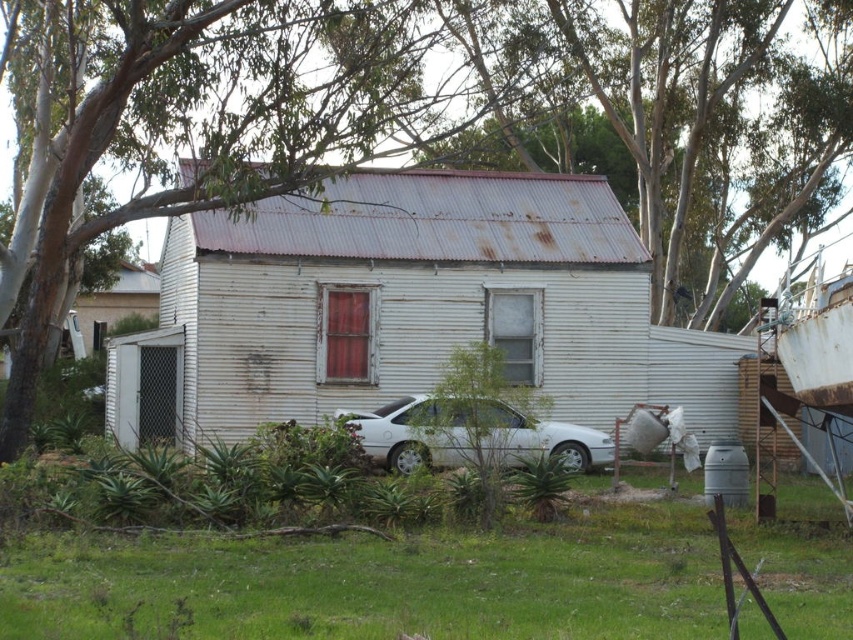
Question: Which point is closer to the camera?

Choices:
 (A) green leafy tree at upper center
 (B) rusty metal roof at upper center

Answer: (A)

Question: Does green grass at lower center come behind white matte car at center?

Choices:
 (A) yes
 (B) no

Answer: (B)

Question: Observing the image, what is the correct spatial positioning of green grass at lower center in reference to rusty metal roof at upper center?

Choices:
 (A) left
 (B) right

Answer: (A)

Question: Estimate the real-world distances between objects in this image. Which object is farther from the white matte car at center?

Choices:
 (A) green leafy tree at upper center
 (B) rusty metal roof at upper center

Answer: (B)

Question: From the image, what is the correct spatial relationship of rusty metal roof at upper center in relation to green leafy tree at upper center?

Choices:
 (A) above
 (B) below

Answer: (A)

Question: Which object appears farthest from the camera in this image?

Choices:
 (A) green grass at lower center
 (B) white matte car at center
 (C) rusty metal roof at upper center
 (D) green leafy tree at upper center

Answer: (C)